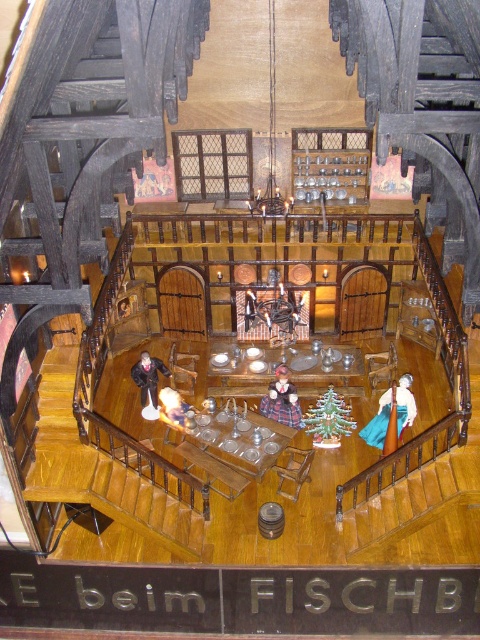
Question: Considering the relative positions of wooden stairs at center and blue fabric dress at lower right in the image provided, where is wooden stairs at center located with respect to blue fabric dress at lower right?

Choices:
 (A) below
 (B) above

Answer: (A)

Question: Which object is farther from the camera taking this photo?

Choices:
 (A) black velvet coat at center
 (B) blue fabric dress at lower right
 (C) wooden stairs at center

Answer: (A)

Question: Is smooth fabric doll at center wider than black velvet coat at center?

Choices:
 (A) no
 (B) yes

Answer: (B)

Question: Which of the following is the closest to the observer?

Choices:
 (A) smooth beige doll at center
 (B) smooth fabric doll at center
 (C) black velvet coat at center

Answer: (A)

Question: Which point is farther to the camera?

Choices:
 (A) smooth fabric doll at center
 (B) black velvet coat at center
 (C) blue fabric dress at lower right
 (D) smooth beige doll at center

Answer: (B)

Question: Can you confirm if blue fabric dress at lower right is bigger than smooth beige doll at center?

Choices:
 (A) no
 (B) yes

Answer: (B)